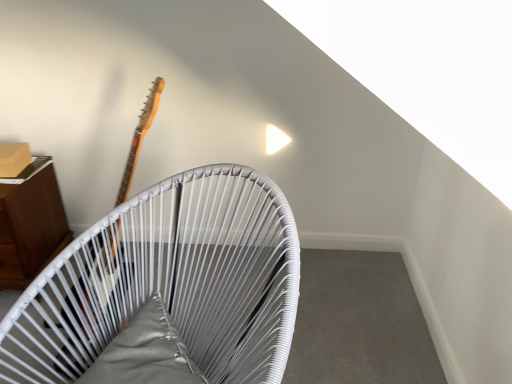
What do you see at coordinates (30, 228) in the screenshot? This screenshot has height=384, width=512. I see `wooden cabinet at left, the second furniture positioned from the front` at bounding box center [30, 228].

Identify the location of white woven chair at upper center, which is counted as the second furniture, starting from the back. (170, 281).

In order to face white woven chair at upper center, which is counted as the second furniture, starting from the back, should I rotate leftwards or rightwards?

To face it directly, rotate left by 12.152 degrees.

Locate an element on the screen. The height and width of the screenshot is (384, 512). wooden guitar at left is located at coordinates (94, 287).

In the scene shown: Is the position of wooden cabinet at left, marked as the second furniture in a right-to-left arrangement, less distant than that of white woven chair at upper center, which ranks as the first furniture in right-to-left order?

No.

Considering the points (27, 283) and (26, 370), which point is in front, point (27, 283) or point (26, 370)?

The point (26, 370) is more forward.

Measure the distance between wooden cabinet at left, marked as the second furniture in a right-to-left arrangement, and white woven chair at upper center, which is counted as the second furniture, starting from the back.

A distance of 74.58 centimeters exists between wooden cabinet at left, marked as the second furniture in a right-to-left arrangement, and white woven chair at upper center, which is counted as the second furniture, starting from the back.

Is wooden cabinet at left, the second furniture positioned from the front, next to white woven chair at upper center, marked as the first furniture in a front-to-back arrangement, and touching it?

wooden cabinet at left, the second furniture positioned from the front, and white woven chair at upper center, marked as the first furniture in a front-to-back arrangement, are clearly separated.

From the picture: Can you confirm if white woven chair at upper center, which is counted as the second furniture, starting from the back, is bigger than wooden cabinet at left, marked as the second furniture in a right-to-left arrangement?

Indeed, white woven chair at upper center, which is counted as the second furniture, starting from the back, has a larger size compared to wooden cabinet at left, marked as the second furniture in a right-to-left arrangement.

From a real-world perspective, which is physically below, white woven chair at upper center, marked as the first furniture in a front-to-back arrangement, or wooden cabinet at left, marked as the second furniture in a right-to-left arrangement?

wooden cabinet at left, marked as the second furniture in a right-to-left arrangement, from a real-world perspective.

Which is in front, point (85, 299) or point (22, 200)?

Positioned in front is point (85, 299).

Is white woven chair at upper center, which ranks as the first furniture in right-to-left order, oriented away from wooden guitar at left?

No, wooden guitar at left is not at the back of white woven chair at upper center, which ranks as the first furniture in right-to-left order.

In the image, is white woven chair at upper center, which is counted as the 2th furniture, starting from the left, positioned in front of or behind wooden guitar at left?

Clearly, white woven chair at upper center, which is counted as the 2th furniture, starting from the left, is in front of wooden guitar at left.

Consider the image. From a real-world perspective, is white woven chair at upper center, marked as the first furniture in a front-to-back arrangement, above or below wooden guitar at left?

In terms of real-world spatial position, white woven chair at upper center, marked as the first furniture in a front-to-back arrangement, is below wooden guitar at left.

Is white woven chair at upper center, which is counted as the second furniture, starting from the back, positioned beyond the bounds of wooden guitar at left?

That's correct, white woven chair at upper center, which is counted as the second furniture, starting from the back, is outside of wooden guitar at left.

Is point (36, 274) closer or farther from the camera than point (147, 96)?

Point (36, 274) is closer to the camera than point (147, 96).

Between wooden cabinet at left, marked as the second furniture in a right-to-left arrangement, and wooden guitar at left, which one has more height?

wooden guitar at left is taller.

In terms of size, does wooden cabinet at left, the second furniture positioned from the front, appear bigger or smaller than wooden guitar at left?

wooden cabinet at left, the second furniture positioned from the front, is smaller than wooden guitar at left.

From the image's perspective, between wooden guitar at left and wooden cabinet at left, the second furniture positioned from the front, which one is located above?

wooden guitar at left.

Is the depth of wooden guitar at left less than that of wooden cabinet at left, the second furniture positioned from the front?

Yes.

Considering the sizes of wooden guitar at left and wooden cabinet at left, marked as the second furniture in a right-to-left arrangement, in the image, is wooden guitar at left wider or thinner than wooden cabinet at left, marked as the second furniture in a right-to-left arrangement,?

wooden guitar at left is wider than wooden cabinet at left, marked as the second furniture in a right-to-left arrangement.

Is wooden guitar at left oriented towards wooden cabinet at left, the second furniture positioned from the front?

No, wooden guitar at left is not oriented towards wooden cabinet at left, the second furniture positioned from the front.

Considering the relative sizes of wooden guitar at left and white woven chair at upper center, which is counted as the 2th furniture, starting from the left, in the image provided, is wooden guitar at left smaller than white woven chair at upper center, which is counted as the 2th furniture, starting from the left,?

Yes.

From the image's perspective, is wooden guitar at left over white woven chair at upper center, marked as the first furniture in a front-to-back arrangement?

Yes, from the image's perspective, wooden guitar at left is on top of white woven chair at upper center, marked as the first furniture in a front-to-back arrangement.

Between wooden guitar at left and white woven chair at upper center, which is counted as the 2th furniture, starting from the left, which one appears on the left side from the viewer's perspective?

wooden guitar at left.

Which object is more forward, wooden guitar at left or white woven chair at upper center, which is counted as the 2th furniture, starting from the left?

white woven chair at upper center, which is counted as the 2th furniture, starting from the left.

Locate an element on the screen. furniture located above the white woven chair at upper center, marked as the first furniture in a front-to-back arrangement (from the image's perspective) is located at coordinates pos(30,228).

The image size is (512, 384). I want to click on furniture on the right of the wooden cabinet at left, marked as the second furniture in a right-to-left arrangement, so click(x=170, y=281).

Which object lies nearer to the anchor point white woven chair at upper center, which is counted as the second furniture, starting from the back, wooden guitar at left or wooden cabinet at left, the second furniture positioned from the front?

wooden guitar at left is closer to white woven chair at upper center, which is counted as the second furniture, starting from the back.

Considering their positions, is wooden guitar at left positioned further to wooden cabinet at left, which is the first furniture in back-to-front order, than white woven chair at upper center, marked as the first furniture in a front-to-back arrangement?

Based on the image, white woven chair at upper center, marked as the first furniture in a front-to-back arrangement, appears to be further to wooden cabinet at left, which is the first furniture in back-to-front order.

Looking at the image, which one is located further to wooden guitar at left, wooden cabinet at left, which is counted as the first furniture, starting from the left, or white woven chair at upper center, marked as the first furniture in a front-to-back arrangement?

Based on the image, wooden cabinet at left, which is counted as the first furniture, starting from the left, appears to be further to wooden guitar at left.

When comparing their distances from white woven chair at upper center, marked as the first furniture in a front-to-back arrangement, does wooden cabinet at left, which is counted as the first furniture, starting from the left, or wooden guitar at left seem closer?

wooden guitar at left is closer to white woven chair at upper center, marked as the first furniture in a front-to-back arrangement.

When comparing their distances from wooden cabinet at left, marked as the second furniture in a right-to-left arrangement, does white woven chair at upper center, marked as the first furniture in a front-to-back arrangement, or wooden guitar at left seem further?

white woven chair at upper center, marked as the first furniture in a front-to-back arrangement.

Based on their spatial positions, is white woven chair at upper center, marked as the first furniture in a front-to-back arrangement, or wooden cabinet at left, which is counted as the first furniture, starting from the left, closer to wooden guitar at left?

white woven chair at upper center, marked as the first furniture in a front-to-back arrangement, is positioned closer to the anchor wooden guitar at left.

You are a GUI agent. You are given a task and a screenshot of the screen. Output one action in this format:
    pyautogui.click(x=<x>, y=<y>)
    Task: Click on the guitar between white woven chair at upper center, which is counted as the second furniture, starting from the back, and wooden cabinet at left, the second furniture positioned from the front, in the front-back direction
    Image resolution: width=512 pixels, height=384 pixels.
    Given the screenshot: What is the action you would take?
    pyautogui.click(x=94, y=287)